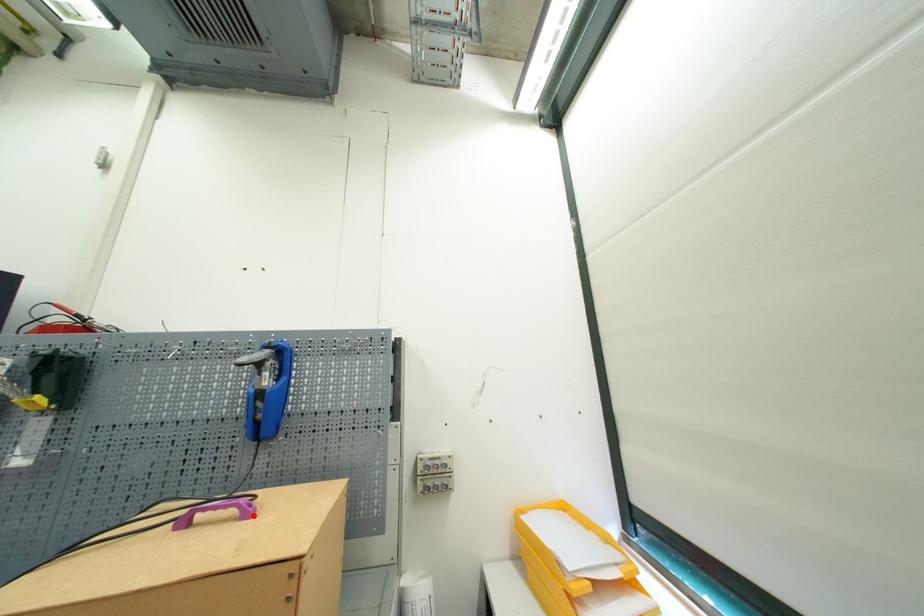
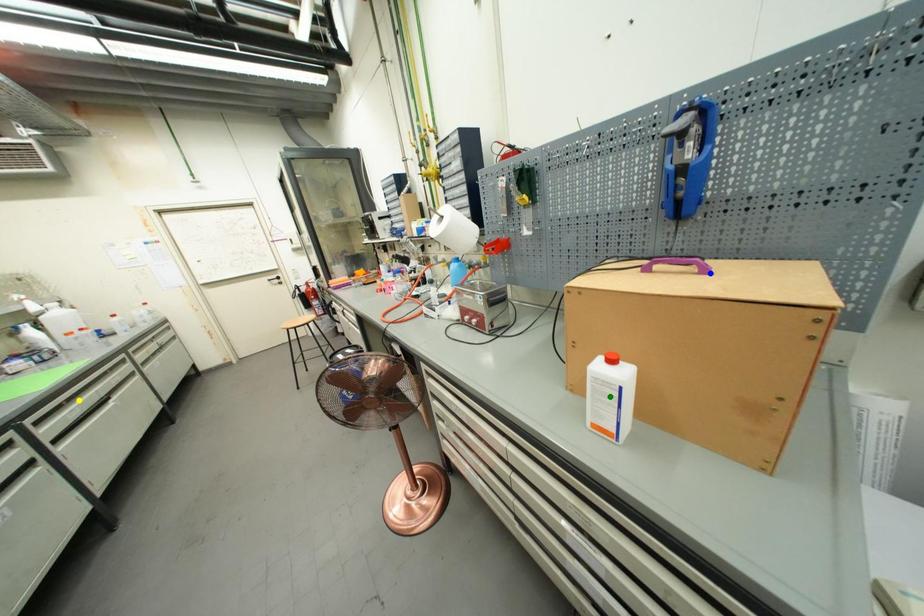
Question: I am providing you with two images of the same scene from different viewpoints. A red point is marked on the first image. You are given multiple points on the second image. Which mark in image 2 goes with the point in image 1?

Choices:
 (A) yellow point
 (B) blue point
 (C) green point

Answer: (B)